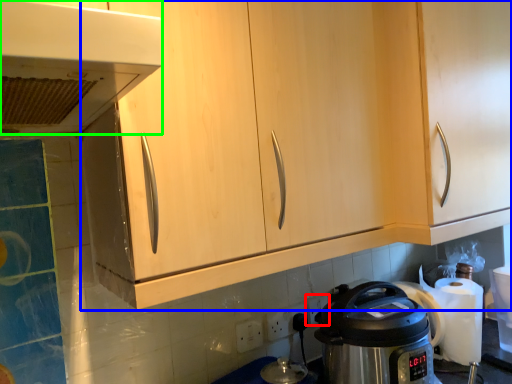
Question: Considering the real-world distances, which object is closest to electric outlet (highlighted by a red box)? cabinetry (highlighted by a blue box) or home appliance (highlighted by a green box).

Choices:
 (A) cabinetry
 (B) home appliance

Answer: (A)